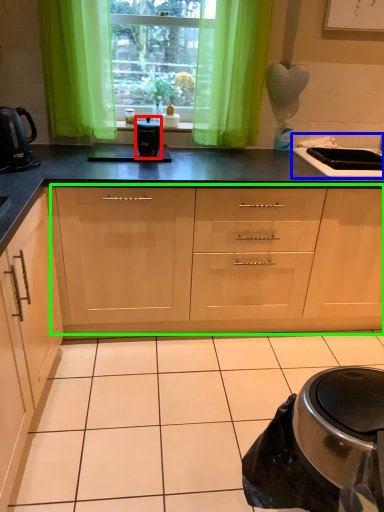
Question: Considering the real-world distances, which object is closest to kitchen appliance (highlighted by a red box)? sink (highlighted by a blue box) or cabinetry (highlighted by a green box).

Choices:
 (A) sink
 (B) cabinetry

Answer: (B)